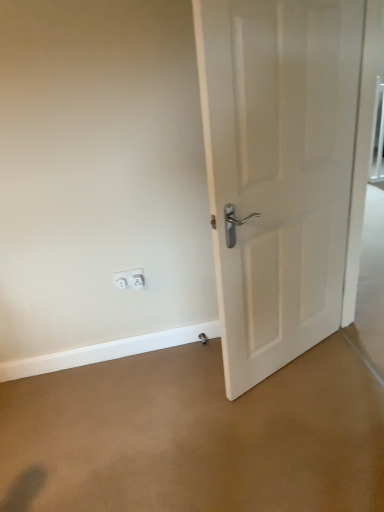
Question: From the image's perspective, is brown carpet at center located above white matte door at right?

Choices:
 (A) no
 (B) yes

Answer: (A)

Question: Does brown carpet at center turn towards white matte door at right?

Choices:
 (A) yes
 (B) no

Answer: (B)

Question: Can you confirm if brown carpet at center is shorter than white matte door at right?

Choices:
 (A) yes
 (B) no

Answer: (A)

Question: Can you confirm if brown carpet at center is bigger than white matte door at right?

Choices:
 (A) no
 (B) yes

Answer: (A)

Question: Can you see brown carpet at center touching white matte door at right?

Choices:
 (A) yes
 (B) no

Answer: (B)

Question: Can white matte door at right be found inside brown carpet at center?

Choices:
 (A) yes
 (B) no

Answer: (B)

Question: Is white matte door at right thinner than brown carpet at center?

Choices:
 (A) yes
 (B) no

Answer: (A)

Question: Can you confirm if white matte door at right is taller than brown carpet at center?

Choices:
 (A) yes
 (B) no

Answer: (A)

Question: Considering the relative sizes of white matte door at right and brown carpet at center in the image provided, is white matte door at right smaller than brown carpet at center?

Choices:
 (A) yes
 (B) no

Answer: (B)

Question: Is white matte door at right to the right of brown carpet at center from the viewer's perspective?

Choices:
 (A) no
 (B) yes

Answer: (B)

Question: Considering the relative positions of white matte door at right and brown carpet at center in the image provided, is white matte door at right behind brown carpet at center?

Choices:
 (A) yes
 (B) no

Answer: (B)

Question: Is white matte door at right oriented towards brown carpet at center?

Choices:
 (A) yes
 (B) no

Answer: (B)

Question: From the image's perspective, is white plastic electric outlet at lower left, arranged as the 1th electric outlet when viewed from the left, above white matte door at right?

Choices:
 (A) no
 (B) yes

Answer: (A)